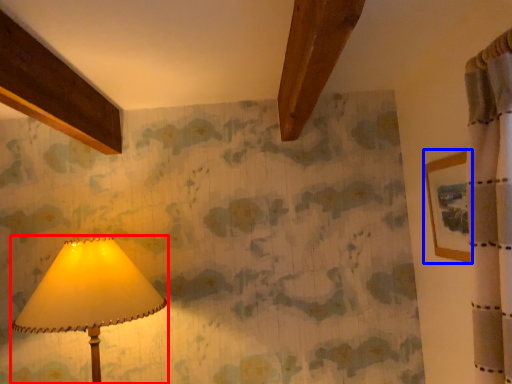
Question: Which point is closer to the camera, lamp (highlighted by a red box) or picture frame (highlighted by a blue box)?

Choices:
 (A) lamp
 (B) picture frame

Answer: (B)